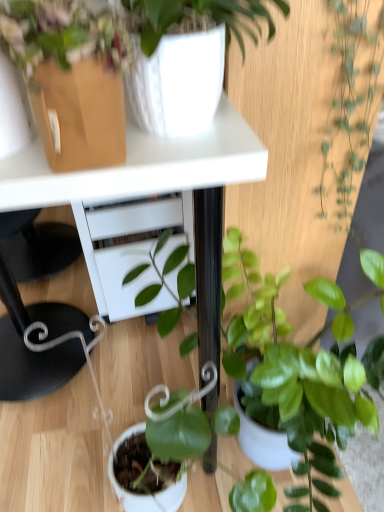
Question: Does green glossy plant at center, which is counted as the 3th houseplant, starting from the top, appear on the right side of green glossy plant at right, which is the first houseplant in top-to-bottom order?

Choices:
 (A) yes
 (B) no

Answer: (A)

Question: From the image's perspective, is green glossy plant at center, which is counted as the 3th houseplant, starting from the top, above green glossy plant at right, the 3th houseplant in the bottom-to-top sequence?

Choices:
 (A) no
 (B) yes

Answer: (A)

Question: Is green glossy plant at center, which is counted as the 3th houseplant, starting from the top, wider than green glossy plant at right, which is the first houseplant in top-to-bottom order?

Choices:
 (A) yes
 (B) no

Answer: (A)

Question: Can you confirm if green glossy plant at center, the 1th houseplant in the bottom-to-top sequence, is smaller than green glossy plant at right, the 3th houseplant in the bottom-to-top sequence?

Choices:
 (A) yes
 (B) no

Answer: (B)

Question: Is green glossy plant at right, the 3th houseplant in the bottom-to-top sequence, at the back of green glossy plant at center, the 1th houseplant in the bottom-to-top sequence?

Choices:
 (A) yes
 (B) no

Answer: (B)

Question: Based on their sizes in the image, would you say green glossy plant at center, the 1th houseplant in the bottom-to-top sequence, is bigger or smaller than white glossy table at upper center?

Choices:
 (A) small
 (B) big

Answer: (A)

Question: From the image's perspective, is green glossy plant at center, the 1th houseplant in the bottom-to-top sequence, positioned above or below white glossy table at upper center?

Choices:
 (A) below
 (B) above

Answer: (A)

Question: From a real-world perspective, is green glossy plant at center, which is counted as the 3th houseplant, starting from the top, physically located above or below white glossy table at upper center?

Choices:
 (A) above
 (B) below

Answer: (B)

Question: Considering their positions, is green glossy plant at center, the 1th houseplant in the bottom-to-top sequence, located in front of or behind white glossy table at upper center?

Choices:
 (A) behind
 (B) front

Answer: (B)

Question: From the image's perspective, is white glossy vase at upper center, positioned as the second houseplant in top-to-bottom order, located above or below green glossy plant at center, the 1th houseplant in the bottom-to-top sequence?

Choices:
 (A) below
 (B) above

Answer: (B)

Question: From a real-world perspective, is white glossy vase at upper center, which ranks as the 2th houseplant in bottom-to-top order, above or below green glossy plant at center, the 1th houseplant in the bottom-to-top sequence?

Choices:
 (A) above
 (B) below

Answer: (A)

Question: Is white glossy vase at upper center, positioned as the second houseplant in top-to-bottom order, wider or thinner than green glossy plant at center, the 1th houseplant in the bottom-to-top sequence?

Choices:
 (A) thin
 (B) wide

Answer: (A)

Question: Considering the positions of white glossy vase at upper center, positioned as the second houseplant in top-to-bottom order, and green glossy plant at center, which is counted as the 3th houseplant, starting from the top, in the image, is white glossy vase at upper center, positioned as the second houseplant in top-to-bottom order, taller or shorter than green glossy plant at center, which is counted as the 3th houseplant, starting from the top,?

Choices:
 (A) short
 (B) tall

Answer: (A)

Question: Considering their positions, is green glossy plant at right, the 3th houseplant in the bottom-to-top sequence, located in front of or behind green glossy plant at center, the 1th houseplant in the bottom-to-top sequence?

Choices:
 (A) behind
 (B) front

Answer: (A)

Question: Choose the correct answer: Is green glossy plant at right, which is the first houseplant in top-to-bottom order, inside green glossy plant at center, which is counted as the 3th houseplant, starting from the top, or outside it?

Choices:
 (A) inside
 (B) outside

Answer: (A)